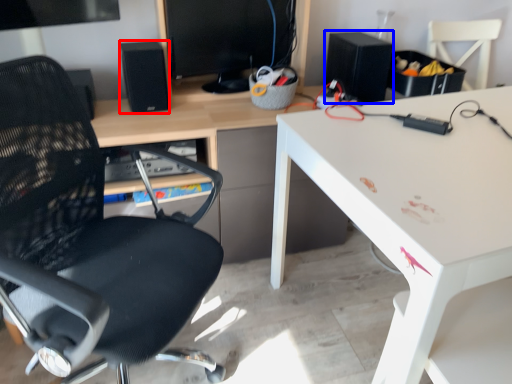
Question: Which object appears farthest to the camera in this image, speaker (highlighted by a red box) or speaker (highlighted by a blue box)?

Choices:
 (A) speaker
 (B) speaker

Answer: (B)